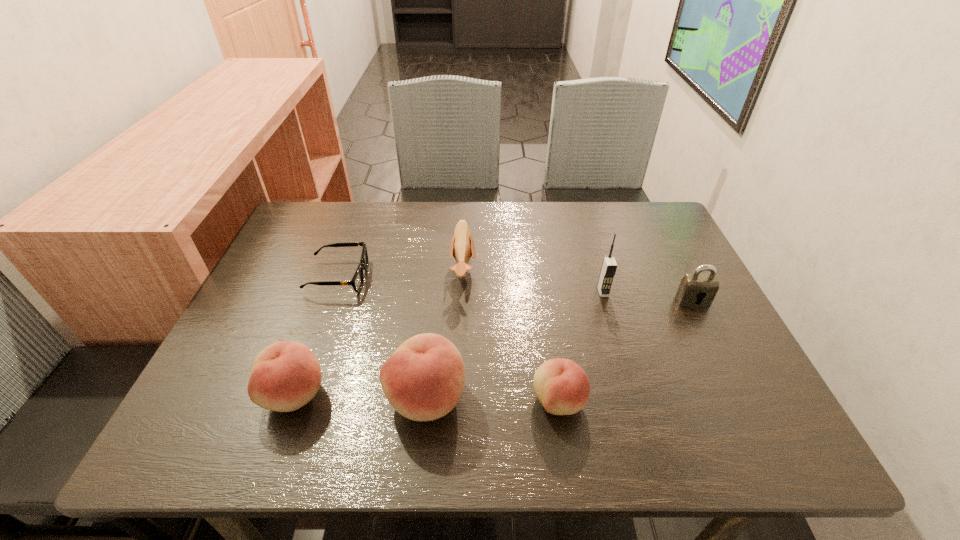
At what (x,y) coordinates should I click in order to perform the action: click on the leftmost peach. Please return your answer as a coordinate pair (x, y). The height and width of the screenshot is (540, 960). Looking at the image, I should click on (286, 375).

I want to click on the tallest peach, so click(x=423, y=380).

In order to click on the second tallest object in this screenshot , I will do `click(423, 380)`.

Image resolution: width=960 pixels, height=540 pixels. In order to click on the sixth tallest object in this screenshot , I will do `click(563, 388)`.

Where is `the rightmost peach`? the rightmost peach is located at coordinates (563, 388).

Locate an element on the screen. the shortest object is located at coordinates (357, 281).

Find the location of a particular element. This screenshot has width=960, height=540. bird is located at coordinates (462, 244).

I want to click on the sixth object from left to right, so click(609, 266).

What are the coordinates of `padlock` in the screenshot? It's located at (696, 289).

Where is `vacant area located on the right of the second shortest peach`? This screenshot has width=960, height=540. vacant area located on the right of the second shortest peach is located at coordinates (492, 394).